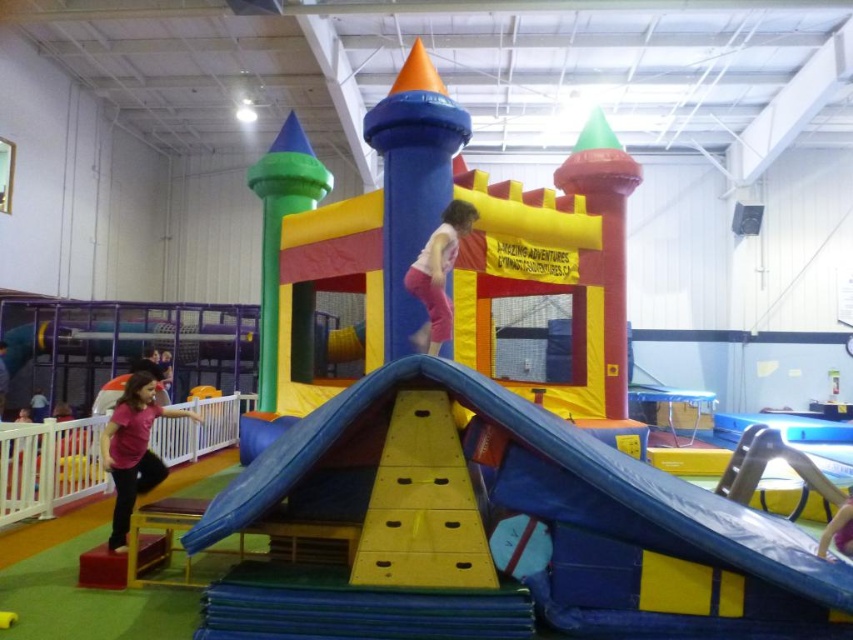
Which of these two, blue/yellow foam slide at center or pink fabric person at center, stands taller?

Standing taller between the two is blue/yellow foam slide at center.

Which is in front, point (380, 512) or point (844, 515)?

Point (380, 512)

The image size is (853, 640). What do you see at coordinates (532, 515) in the screenshot? I see `blue/yellow foam slide at center` at bounding box center [532, 515].

Locate an element on the screen. This screenshot has width=853, height=640. blue/yellow foam slide at center is located at coordinates (532, 515).

Which is above, pink fabric person at center or pink fabric person at lower left?

pink fabric person at center is higher up.

Looking at this image, between pink fabric person at center and pink fabric person at lower left, which one appears on the left side from the viewer's perspective?

Positioned to the left is pink fabric person at lower left.

Describe the element at coordinates (838, 529) in the screenshot. I see `pink fabric person at center` at that location.

Locate an element on the screen. pink fabric person at center is located at coordinates (838, 529).

This screenshot has width=853, height=640. What do you see at coordinates (438, 275) in the screenshot? I see `pink fabric pants at upper center` at bounding box center [438, 275].

Does pink fabric pants at upper center have a smaller size compared to pink fabric person at lower left?

Yes.

Which is in front, point (418, 278) or point (7, 374)?

Point (418, 278) is in front.

Locate an element on the screen. The height and width of the screenshot is (640, 853). pink fabric pants at upper center is located at coordinates (438, 275).